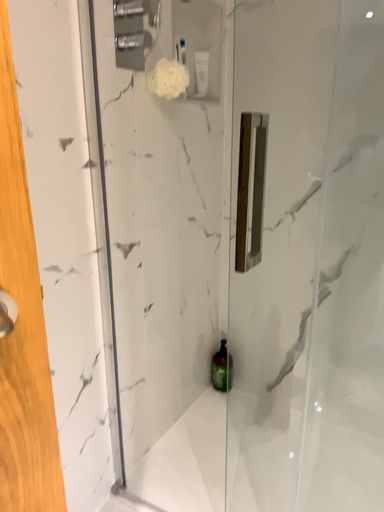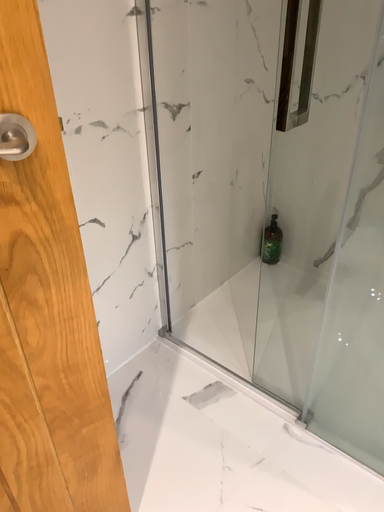
Question: How did the camera likely rotate when shooting the video?

Choices:
 (A) rotated right
 (B) rotated left

Answer: (B)